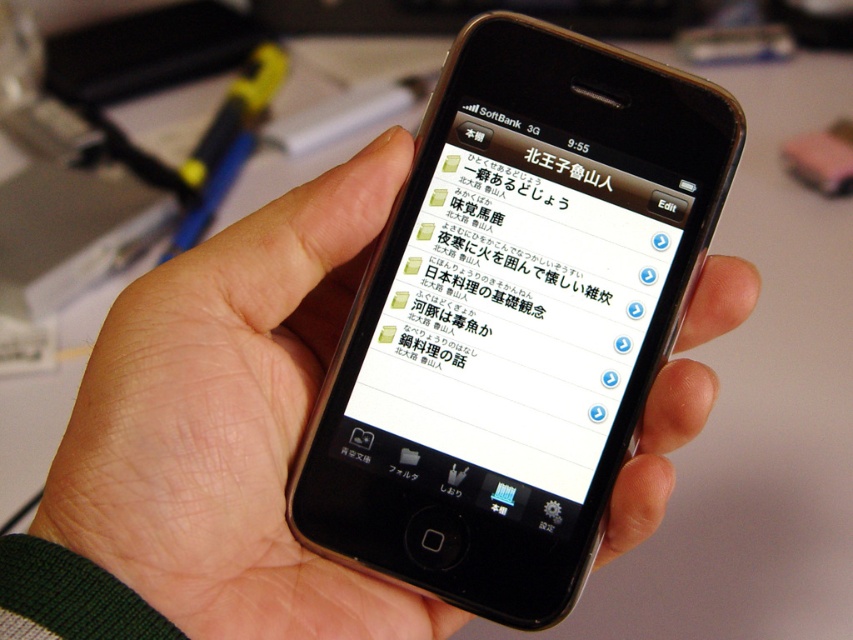
You are designing a user interface for a study app. You need to ensure that the white glossy text at center is easily readable on the black matte phone at center. Considering their sizes, what adjustment should you make?

The black matte phone at center has a larger size compared to white glossy text at center, so to ensure readability, you should increase the font size of the white glossy text at center to match the phone screen size.

You are trying to touch the screen of the smartphone in the image. Which of the two points, point (393, 168) or point (444, 214), is closer to your fingertip when you aim to touch the screen at those coordinates?

Point (393, 168) is closer to the viewer than point (444, 214), so it would be closer to your fingertip when touching the screen at those coordinates.

In the scene shown: You are trying to read the text on the screen of the black matte phone at center, but it is partially obscured. Which object is blocking your view of the white glossy text at center?

The black matte phone at center is positioned under the white glossy text at center, so the phone itself is not blocking the text. However, since the phone is holding the text, it might be the screen or another element on the phone that is causing the obstruction. Without more details, it is unclear what exactly is blocking the view.